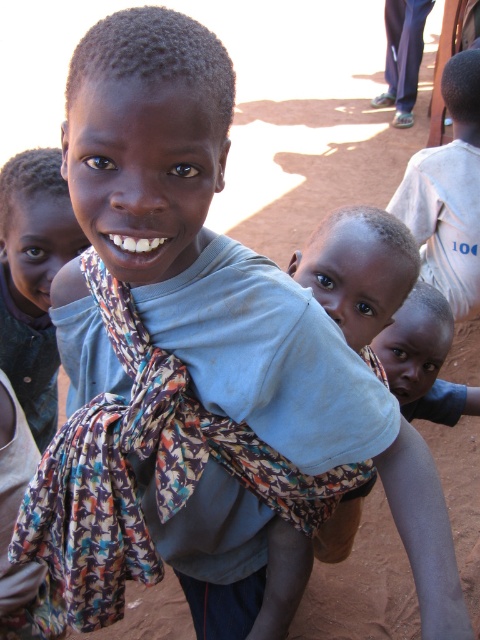
You are a photographer trying to capture a clear shot of the light blue fabric at center and the white cotton shirt at right. Since you want to focus on both objects equally, which one should you adjust your camera settings to prioritize in terms of size to ensure they appear balanced in the photo?

The light blue fabric at center is larger than the white cotton shirt at right, so to balance their sizes in the photo, you should adjust your camera settings to make the light blue fabric at center appear smaller or move closer to the white cotton shirt at right to reduce the size difference.